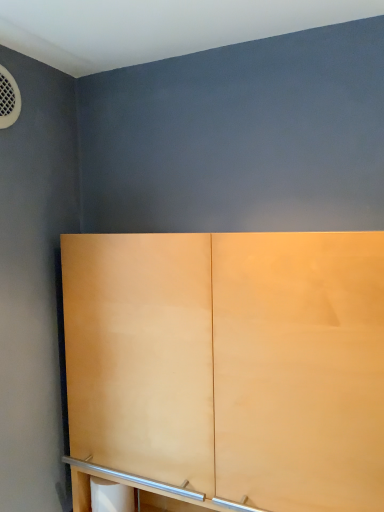
What is the approximate height of matte wood cupboard at center?

matte wood cupboard at center is 30.80 inches tall.

Find the location of `matte wood cupboard at center`. matte wood cupboard at center is located at coordinates (230, 362).

In the scene shown: Measure the distance between matte wood cupboard at center and camera.

They are 28.34 inches apart.

The width and height of the screenshot is (384, 512). What do you see at coordinates (230, 362) in the screenshot? I see `matte wood cupboard at center` at bounding box center [230, 362].

The image size is (384, 512). What do you see at coordinates (111, 496) in the screenshot?
I see `white matte toilet paper at lower center` at bounding box center [111, 496].

In order to click on white matte toilet paper at lower center in this screenshot , I will do `click(111, 496)`.

The height and width of the screenshot is (512, 384). I want to click on matte wood cupboard at center, so click(230, 362).

Does matte wood cupboard at center appear on the right side of white matte toilet paper at lower center?

Indeed, matte wood cupboard at center is positioned on the right side of white matte toilet paper at lower center.

Which is in front, matte wood cupboard at center or white matte toilet paper at lower center?

matte wood cupboard at center.

Is point (149, 238) closer to viewer compared to point (111, 511)?

Yes, it is.

From the image's perspective, who appears lower, matte wood cupboard at center or white matte toilet paper at lower center?

white matte toilet paper at lower center is shown below in the image.

From a real-world perspective, who is located higher, matte wood cupboard at center or white matte toilet paper at lower center?

matte wood cupboard at center, from a real-world perspective.

In terms of width, does matte wood cupboard at center look wider or thinner when compared to white matte toilet paper at lower center?

Clearly, matte wood cupboard at center has more width compared to white matte toilet paper at lower center.

Based on the photo, can you confirm if matte wood cupboard at center is taller than white matte toilet paper at lower center?

Yes, matte wood cupboard at center is taller than white matte toilet paper at lower center.

Is matte wood cupboard at center bigger or smaller than white matte toilet paper at lower center?

In the image, matte wood cupboard at center appears to be larger than white matte toilet paper at lower center.

Is white matte toilet paper at lower center surrounded by matte wood cupboard at center?

Yes, white matte toilet paper at lower center can be found within matte wood cupboard at center.

Is matte wood cupboard at center placed right next to white matte toilet paper at lower center?

matte wood cupboard at center and white matte toilet paper at lower center are not in contact.

Could you tell me if matte wood cupboard at center is facing white matte toilet paper at lower center?

Yes, matte wood cupboard at center faces towards white matte toilet paper at lower center.

Image resolution: width=384 pixels, height=512 pixels. What are the coordinates of `toilet paper below the matte wood cupboard at center (from the image's perspective)` in the screenshot? It's located at (111, 496).

Considering the positions of objects white matte toilet paper at lower center and matte wood cupboard at center in the image provided, who is more to the left, white matte toilet paper at lower center or matte wood cupboard at center?

Positioned to the left is white matte toilet paper at lower center.

Relative to matte wood cupboard at center, is white matte toilet paper at lower center in front or behind?

white matte toilet paper at lower center is positioned farther from the viewer than matte wood cupboard at center.

Is point (91, 490) closer or farther from the camera than point (81, 374)?

Point (91, 490) is positioned farther from the camera compared to point (81, 374).

From the image's perspective, is white matte toilet paper at lower center located beneath matte wood cupboard at center?

Correct, white matte toilet paper at lower center appears lower than matte wood cupboard at center in the image.

From a real-world perspective, is white matte toilet paper at lower center under matte wood cupboard at center?

Correct, in the physical world, white matte toilet paper at lower center is lower than matte wood cupboard at center.

Considering the sizes of white matte toilet paper at lower center and matte wood cupboard at center in the image, is white matte toilet paper at lower center wider or thinner than matte wood cupboard at center?

In the image, white matte toilet paper at lower center appears to be more narrow than matte wood cupboard at center.

Does white matte toilet paper at lower center have a lesser height compared to matte wood cupboard at center?

Indeed, white matte toilet paper at lower center has a lesser height compared to matte wood cupboard at center.

Consider the image. Does white matte toilet paper at lower center have a larger size compared to matte wood cupboard at center?

Actually, white matte toilet paper at lower center might be smaller than matte wood cupboard at center.

Is white matte toilet paper at lower center positioned beyond the bounds of matte wood cupboard at center?

Actually, white matte toilet paper at lower center is at least partially inside matte wood cupboard at center.

Is white matte toilet paper at lower center in contact with matte wood cupboard at center?

No, white matte toilet paper at lower center is not next to matte wood cupboard at center.

Is white matte toilet paper at lower center aimed at matte wood cupboard at center?

Yes, white matte toilet paper at lower center is oriented towards matte wood cupboard at center.

What's the angular difference between white matte toilet paper at lower center and matte wood cupboard at center's facing directions?

The facing directions of white matte toilet paper at lower center and matte wood cupboard at center are 2.72 degrees apart.

This screenshot has width=384, height=512. What are the coordinates of `cupboard in front of the white matte toilet paper at lower center` in the screenshot? It's located at (230, 362).

The height and width of the screenshot is (512, 384). I want to click on cupboard lying above the white matte toilet paper at lower center (from the image's perspective), so click(x=230, y=362).

I want to click on cupboard that is in front of the white matte toilet paper at lower center, so [x=230, y=362].